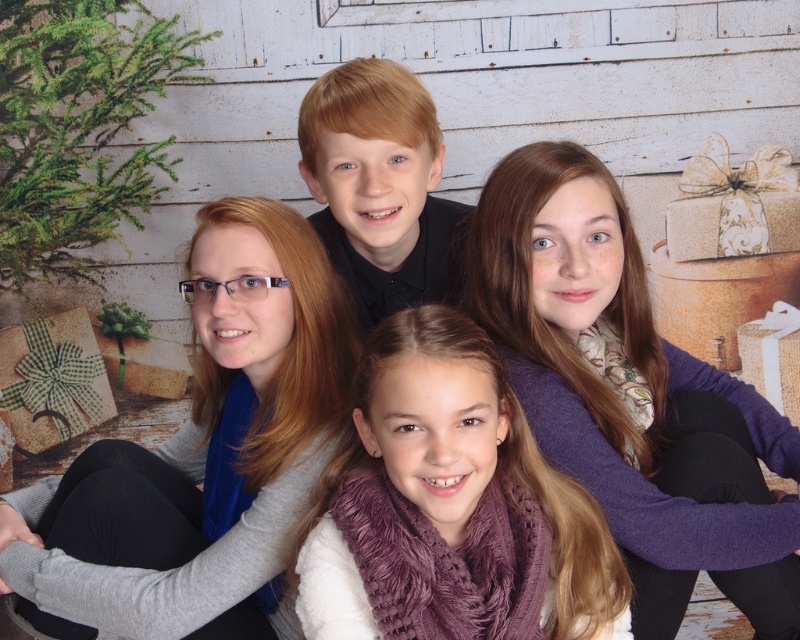
From the picture: Does purple knit scarf at upper right appear under blonde hair at center?

Yes.

Is point (488, 298) less distant than point (345, 195)?

Yes, point (488, 298) is closer to viewer.

Locate an element on the screen. The image size is (800, 640). purple knit scarf at upper right is located at coordinates (630, 396).

Between purple knit scarf at upper right and gray wool scarf at upper left, which one is positioned lower?

gray wool scarf at upper left is below.

Is purple knit scarf at upper right smaller than gray wool scarf at upper left?

Correct, purple knit scarf at upper right occupies less space than gray wool scarf at upper left.

Does point (609, 465) lie in front of point (254, 364)?

Yes, point (609, 465) is closer to viewer.

At what (x,y) coordinates should I click in order to perform the action: click on purple knit scarf at upper right. Please return your answer as a coordinate pair (x, y). Image resolution: width=800 pixels, height=640 pixels. Looking at the image, I should click on (630, 396).

Does point (525, 340) come behind point (520, 445)?

Yes, it is.

Consider the image. Between purple knit scarf at upper right and purple fuzzy scarf at center, which one is positioned lower?

purple fuzzy scarf at center is below.

Is point (628, 477) less distant than point (476, 550)?

No, it is behind (476, 550).

The height and width of the screenshot is (640, 800). What are the coordinates of `purple knit scarf at upper right` in the screenshot? It's located at (630, 396).